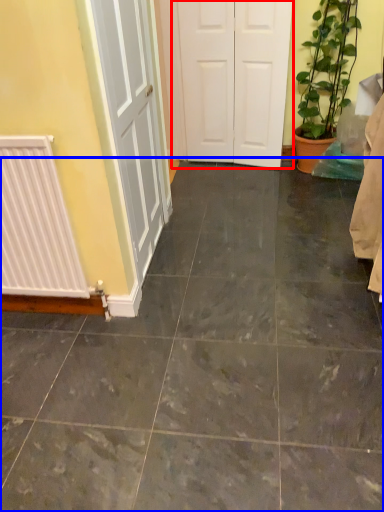
Question: Which object appears farthest to the camera in this image, door (highlighted by a red box) or ceramic tile (highlighted by a blue box)?

Choices:
 (A) door
 (B) ceramic tile

Answer: (A)